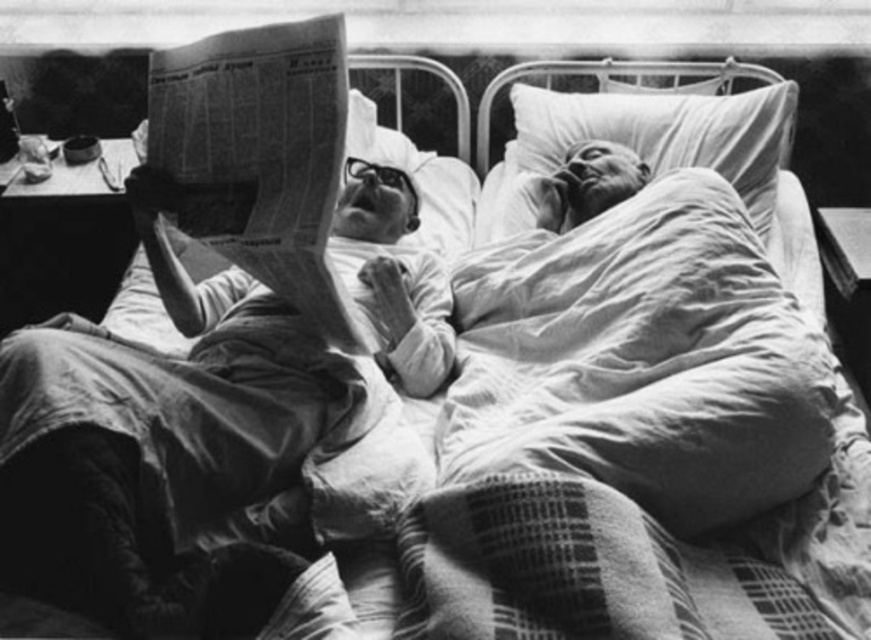
You are a nurse checking the hospital bed. You notice two points marked on the bed. The first point is at coordinates point (309, 259) and the second is at point (770, 141). Which point is nearer to you?

Point (309, 259) is closer to the viewer than point (770, 141).

You are a nurse checking the hospital room. You need to hand a medication bottle to the person on the right who is resting. The medication bottle is on the small table next to the bed. Can you reach the printed newspaper at upper left without stepping out of the bed?

The printed newspaper at upper left is 1.33 meters away from the person on the right. Since the nurse is standing next to the bed, they can easily reach the printed newspaper at upper left while staying near the small table without needing to step out of the bed.

You are a nurse standing at the foot of the hospital bed. You need to retrieve the smooth paper newspaper at upper left to return it to the lobby. Can you reach it without moving closer than 1 meter from your current position?

The smooth paper newspaper at upper left is 1.24 meters away from the viewer. Since the nurse is at least 1 meter away, they cannot reach it without moving closer.